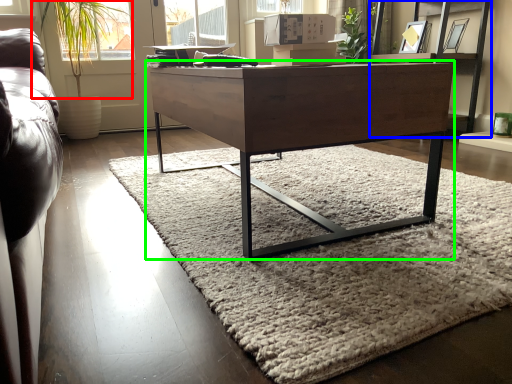
Question: Which object is the closest to the plant (highlighted by a red box)? Choose among these: shelf (highlighted by a blue box) or desk (highlighted by a green box).

Choices:
 (A) shelf
 (B) desk

Answer: (B)